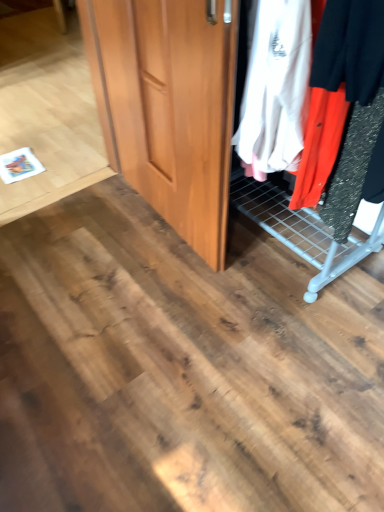
What do you see at coordinates (320, 193) in the screenshot? The image size is (384, 512). I see `wooden wardrobe at center` at bounding box center [320, 193].

This screenshot has width=384, height=512. In order to click on wooden wardrobe at center in this screenshot , I will do `click(320, 193)`.

Locate an element on the screen. Image resolution: width=384 pixels, height=512 pixels. wooden door at center is located at coordinates (168, 106).

What do you see at coordinates (168, 106) in the screenshot? I see `wooden door at center` at bounding box center [168, 106].

This screenshot has height=512, width=384. I want to click on wooden wardrobe at center, so click(x=320, y=193).

In the image, is wooden door at center on the left side or the right side of wooden wardrobe at center?

From the image, it's evident that wooden door at center is to the left of wooden wardrobe at center.

From the picture: Considering the positions of objects wooden door at center and wooden wardrobe at center in the image provided, who is in front, wooden door at center or wooden wardrobe at center?

wooden wardrobe at center.

Which is closer to the camera, (159,33) or (280,13)?

Point (159,33) appears to be farther away from the viewer than point (280,13).

From the image's perspective, is wooden door at center above wooden wardrobe at center?

No, from the image's perspective, wooden door at center is not on top of wooden wardrobe at center.

From a real-world perspective, who is located higher, wooden door at center or wooden wardrobe at center?

From a 3D spatial view, wooden wardrobe at center is above.

Considering the sizes of objects wooden door at center and wooden wardrobe at center in the image provided, who is wider, wooden door at center or wooden wardrobe at center?

wooden wardrobe at center is wider.

Which of these two, wooden door at center or wooden wardrobe at center, stands taller?

wooden door at center.

Considering the relative sizes of wooden door at center and wooden wardrobe at center in the image provided, is wooden door at center smaller than wooden wardrobe at center?

Yes, wooden door at center is smaller than wooden wardrobe at center.

Is wooden door at center not inside wooden wardrobe at center?

Yes.

Is wooden door at center directly adjacent to wooden wardrobe at center?

No, wooden door at center is not beside wooden wardrobe at center.

Is wooden door at center oriented away from wooden wardrobe at center?

Yes.

What's the angular difference between wooden door at center and wooden wardrobe at center's facing directions?

The angular difference between wooden door at center and wooden wardrobe at center is 3.66 degrees.

I want to click on door below the wooden wardrobe at center (from the image's perspective), so click(168, 106).

Considering the relative positions of wooden wardrobe at center and wooden door at center in the image provided, is wooden wardrobe at center to the right of wooden door at center from the viewer's perspective?

Yes.

Is wooden wardrobe at center in front of or behind wooden door at center in the image?

wooden wardrobe at center is in front of wooden door at center.

Is point (257, 92) farther from camera compared to point (199, 205)?

No, it is in front of (199, 205).

From the image's perspective, is wooden wardrobe at center above wooden door at center?

Yes.

From a real-world perspective, which object stands above the other?

From a 3D spatial view, wooden wardrobe at center is above.

In terms of width, does wooden wardrobe at center look wider or thinner when compared to wooden door at center?

In the image, wooden wardrobe at center appears to be wider than wooden door at center.

Which of these two, wooden wardrobe at center or wooden door at center, stands taller?

wooden door at center.

Considering the relative sizes of wooden wardrobe at center and wooden door at center in the image provided, is wooden wardrobe at center bigger than wooden door at center?

Yes.

Which is correct: wooden wardrobe at center is inside wooden door at center, or outside of it?

wooden wardrobe at center is located beyond the bounds of wooden door at center.

Is wooden wardrobe at center not close to wooden door at center?

No.

Could you tell me if wooden wardrobe at center is facing wooden door at center?

Yes.

How far apart are wooden wardrobe at center and wooden door at center?

wooden wardrobe at center is 15.20 inches from wooden door at center.

The image size is (384, 512). I want to click on door on the left of wooden wardrobe at center, so click(168, 106).

The height and width of the screenshot is (512, 384). Identify the location of closet lying on the right of wooden door at center. (320, 193).

Identify the location of closet that appears above the wooden door at center (from the image's perspective). (320, 193).